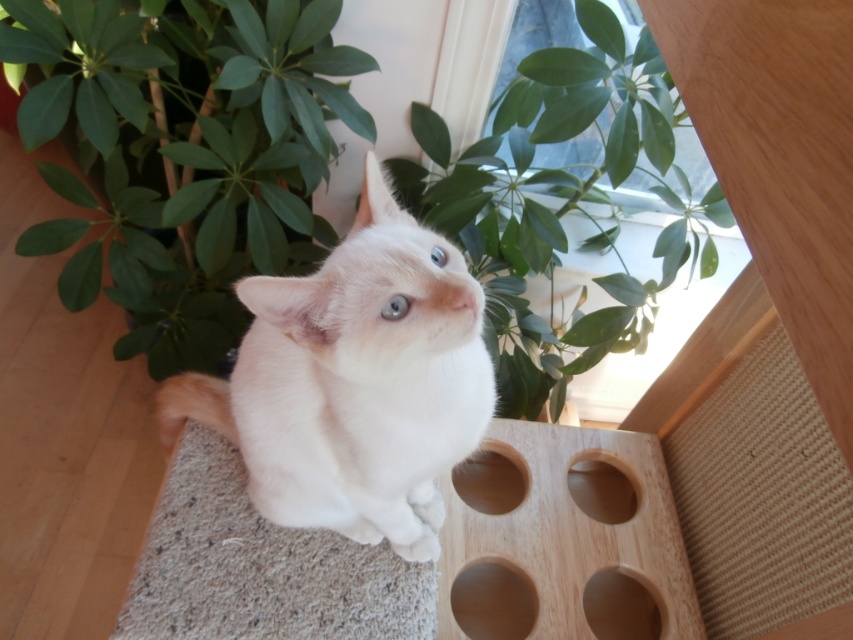
Where is `green leafy plant at upper left`? green leafy plant at upper left is located at coordinates (183, 152).

You are a GUI agent. You are given a task and a screenshot of the screen. Output one action in this format:
    pyautogui.click(x=<x>, y=<y>)
    Task: Click on the green leafy plant at upper left
    
    Given the screenshot: What is the action you would take?
    pyautogui.click(x=183, y=152)

The height and width of the screenshot is (640, 853). Describe the element at coordinates (564, 200) in the screenshot. I see `green leafy plant at upper center` at that location.

Can you confirm if green leafy plant at upper center is bigger than smooth wood hole at lower right?

Yes, green leafy plant at upper center is bigger than smooth wood hole at lower right.

Who is more forward, [427,209] or [611,634]?

Point [611,634] is in front.

Image resolution: width=853 pixels, height=640 pixels. What are the coordinates of `green leafy plant at upper center` in the screenshot? It's located at (564, 200).

Can you confirm if green leafy plant at upper left is positioned below smooth wood hole at lower right?

No, green leafy plant at upper left is not below smooth wood hole at lower right.

Between point (305, 60) and point (601, 627), which one is positioned in front?

Point (305, 60)

Image resolution: width=853 pixels, height=640 pixels. I want to click on green leafy plant at upper left, so click(x=183, y=152).